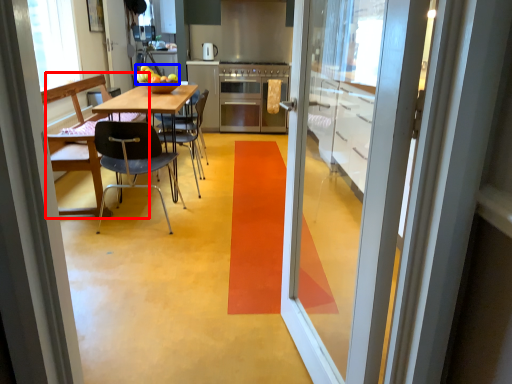
Question: Among these objects, which one is farthest to the camera, chair (highlighted by a red box) or fruit (highlighted by a blue box)?

Choices:
 (A) chair
 (B) fruit

Answer: (B)